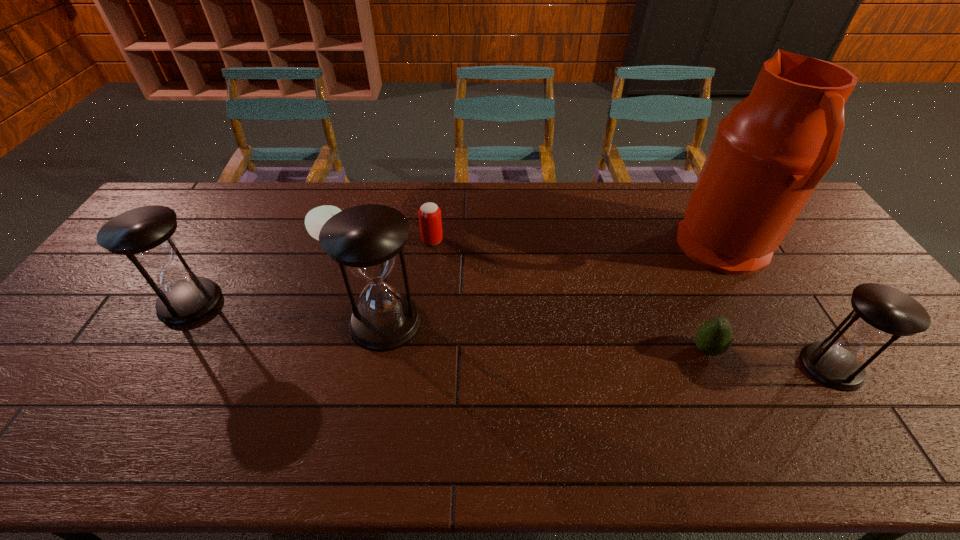
Locate an element on the screen. This screenshot has width=960, height=540. vacant space at the far edge is located at coordinates (459, 202).

Identify the location of free point at the right edge. (912, 348).

Where is `free space between the apple and the tallest object`? The width and height of the screenshot is (960, 540). free space between the apple and the tallest object is located at coordinates (527, 244).

Locate an element on the screen. The width and height of the screenshot is (960, 540). free area in between the beer can and the fourth shortest object is located at coordinates (632, 303).

Where is `free space between the second hourglass from left to right and the beer can`? The width and height of the screenshot is (960, 540). free space between the second hourglass from left to right and the beer can is located at coordinates (409, 281).

What are the coordinates of `free spot between the fifth shortest object and the beer can` in the screenshot? It's located at (311, 271).

Where is `free space between the third tallest object and the shortest hourglass`? The height and width of the screenshot is (540, 960). free space between the third tallest object and the shortest hourglass is located at coordinates (511, 334).

Where is `free space between the second object from left to right and the second hourglass from right to left`? free space between the second object from left to right and the second hourglass from right to left is located at coordinates (358, 280).

You are a GUI agent. You are given a task and a screenshot of the screen. Output one action in this format:
    pyautogui.click(x=<x>, y=<y>)
    Task: Click on the free space between the beer can and the shortest hourglass
    
    Given the screenshot: What is the action you would take?
    pyautogui.click(x=632, y=303)

Find the location of a particular element. This screenshot has height=540, width=960. vacant area between the shortest hourglass and the beer can is located at coordinates (632, 303).